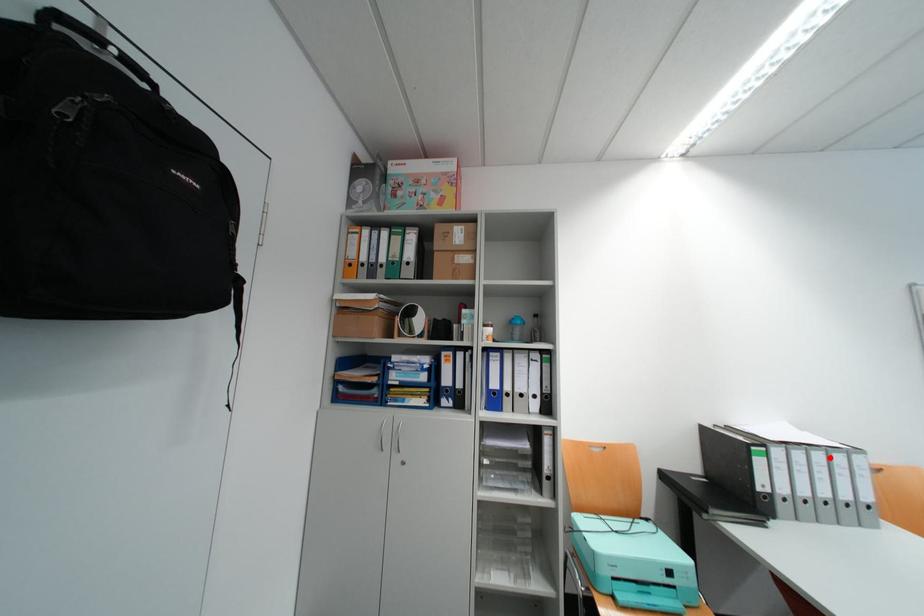
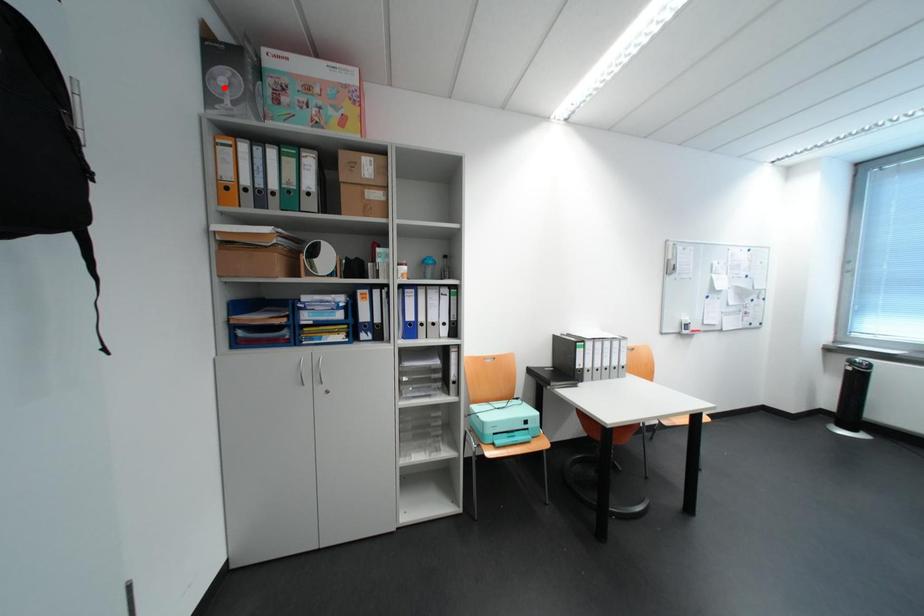
I am providing you with two images of the same scene from different viewpoints. A red point is marked on the first image and another point is marked on the second image. Are the points marked in image1 and image2 representing the same 3D position?

No